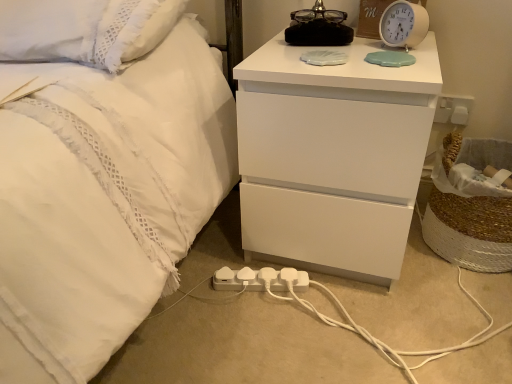
Locate an element on the screen. This screenshot has height=384, width=512. vacant space that's between white matte nightstand at upper right and woven straw laundry basket at lower right is located at coordinates (435, 281).